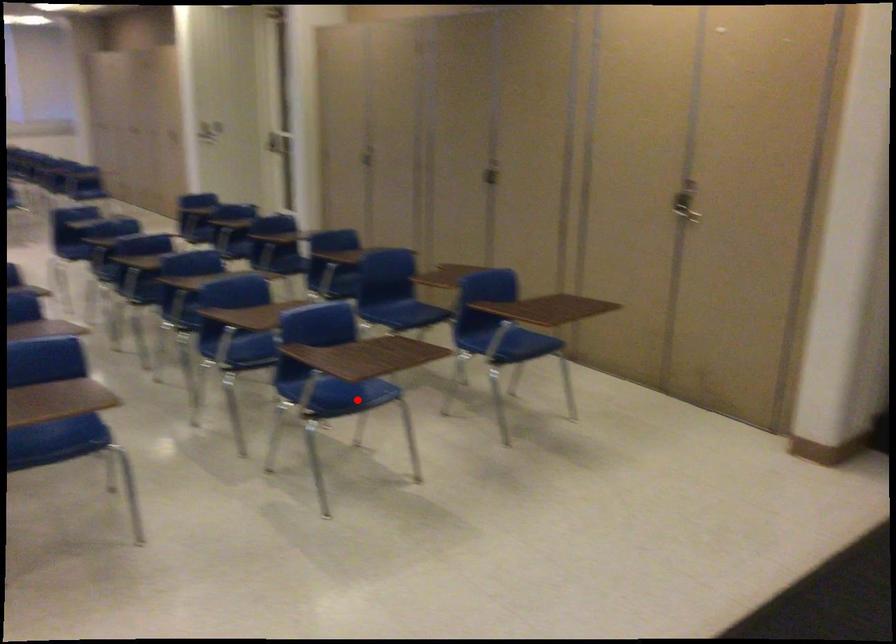
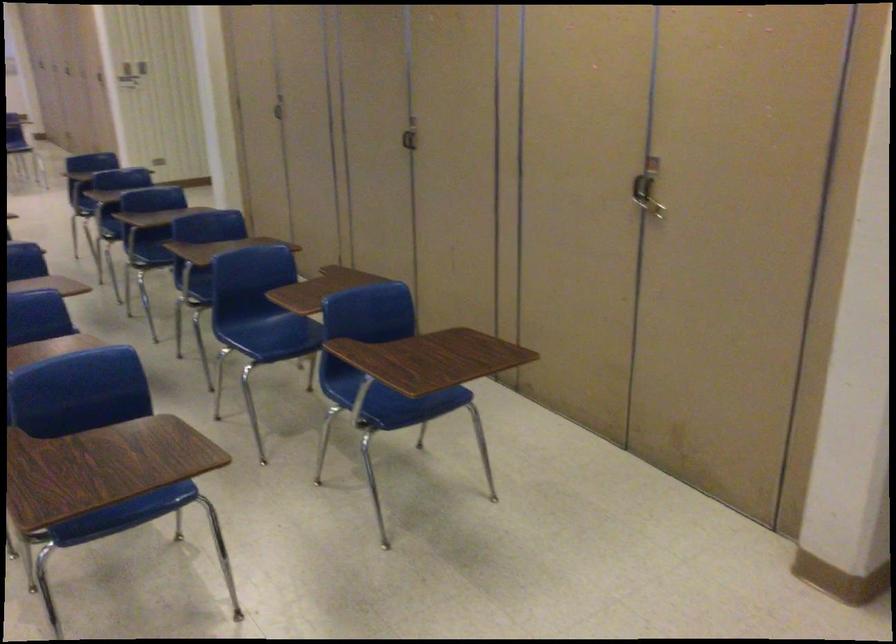
Question: A red point is marked in image1. In image2, is the corresponding 3D point closer to the camera or farther? Reply with the corresponding letter.

Choices:
 (A) The corresponding 3D point is closer.
 (B) The corresponding 3D point is farther.

Answer: (A)